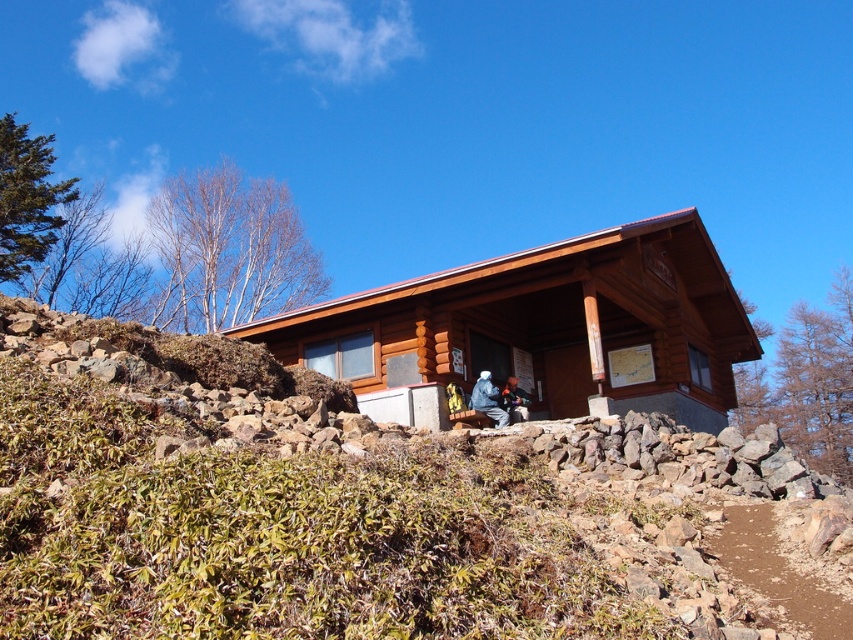
You are standing at the point with coordinates (547, 324). What object is located exactly at your current position?

The brown wooden cabin at center is located exactly at the point with coordinates (547, 324).

You are standing in front of the brown wooden cabin at center and want to hang the blue fuzzy jacket at center on a hook inside the cabin. Considering the height of both objects, will you need a ladder to reach the hook?

The brown wooden cabin at center is taller than the blue fuzzy jacket at center, so you will need a ladder to reach the hook inside the cabin.

You are a hiker who has just arrived at the scene and wants to store your dark blue jacket at lower center in a safe place. The brown wooden cabin at center has a small storage compartment. Can the jacket fit inside if the compartment is 1.2 meters wide?

The brown wooden cabin at center might be wider than dark blue jacket at lower center, but the width of the jacket itself isn